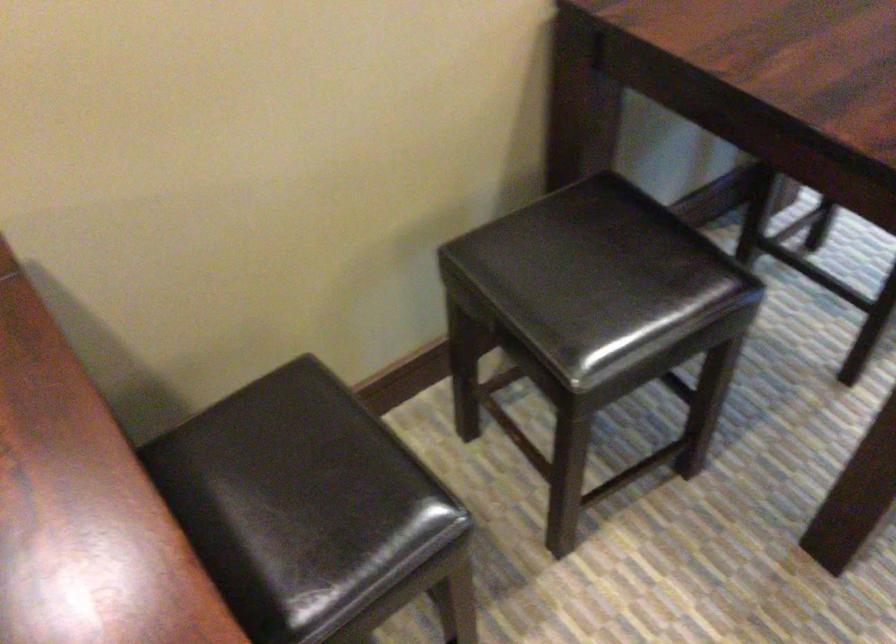
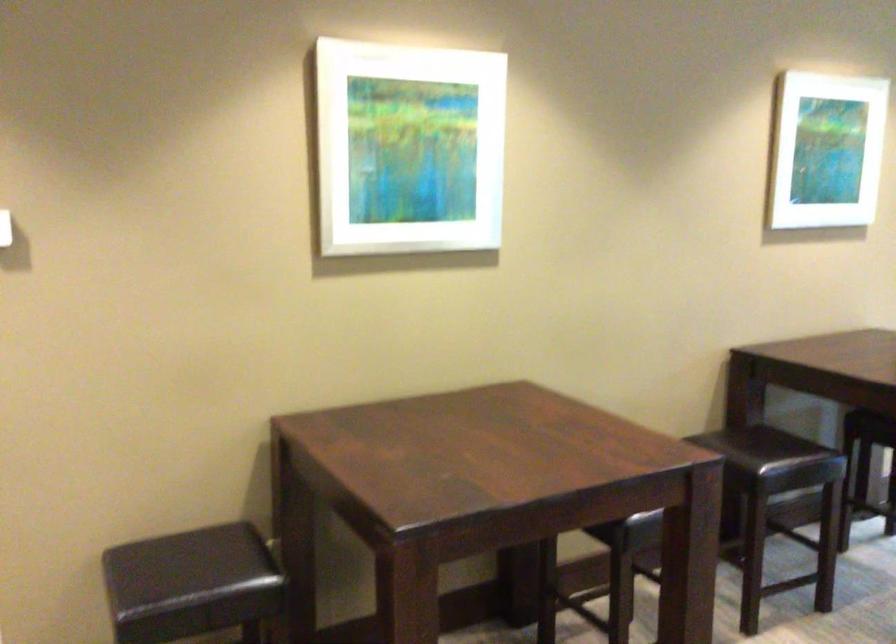
Question: I am providing you with two images of the same scene from different viewpoints. Which of the following objects are not visible in image2?

Choices:
 (A) white screen pull-bar
 (B) black chair sitting surface
 (C) dark chair sitting surface
 (D) white framed art

Answer: (B)